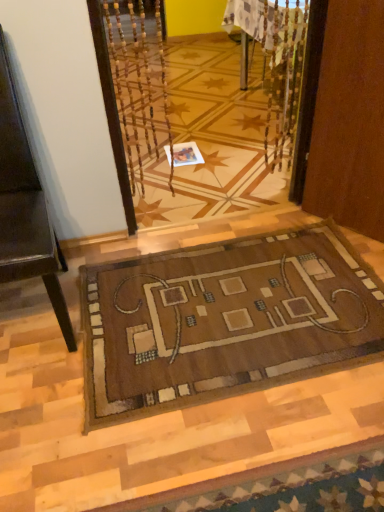
Question: Considering the relative positions of brown woven mat at center and white paper at center in the image provided, is brown woven mat at center behind white paper at center?

Choices:
 (A) no
 (B) yes

Answer: (A)

Question: Does brown woven mat at center have a greater height compared to white paper at center?

Choices:
 (A) yes
 (B) no

Answer: (B)

Question: From the image's perspective, does brown woven mat at center appear lower than white paper at center?

Choices:
 (A) yes
 (B) no

Answer: (A)

Question: Can you confirm if brown woven mat at center is thinner than white paper at center?

Choices:
 (A) no
 (B) yes

Answer: (A)

Question: From a real-world perspective, is brown woven mat at center positioned over white paper at center based on gravity?

Choices:
 (A) yes
 (B) no

Answer: (A)

Question: Is brown woven mat at center outside white paper at center?

Choices:
 (A) yes
 (B) no

Answer: (A)

Question: From a real-world perspective, is white paper at center on top of brown woven mat at center?

Choices:
 (A) yes
 (B) no

Answer: (B)

Question: Can you confirm if white paper at center is positioned to the right of brown woven mat at center?

Choices:
 (A) no
 (B) yes

Answer: (A)

Question: Is the position of white paper at center more distant than that of brown woven mat at center?

Choices:
 (A) no
 (B) yes

Answer: (B)

Question: Is white paper at center shorter than brown woven mat at center?

Choices:
 (A) no
 (B) yes

Answer: (A)

Question: Is white paper at center wider than brown woven mat at center?

Choices:
 (A) yes
 (B) no

Answer: (B)

Question: Is white paper at center turned away from brown woven mat at center?

Choices:
 (A) yes
 (B) no

Answer: (B)

Question: Is brown leather chair at left not near white paper at center?

Choices:
 (A) no
 (B) yes

Answer: (B)